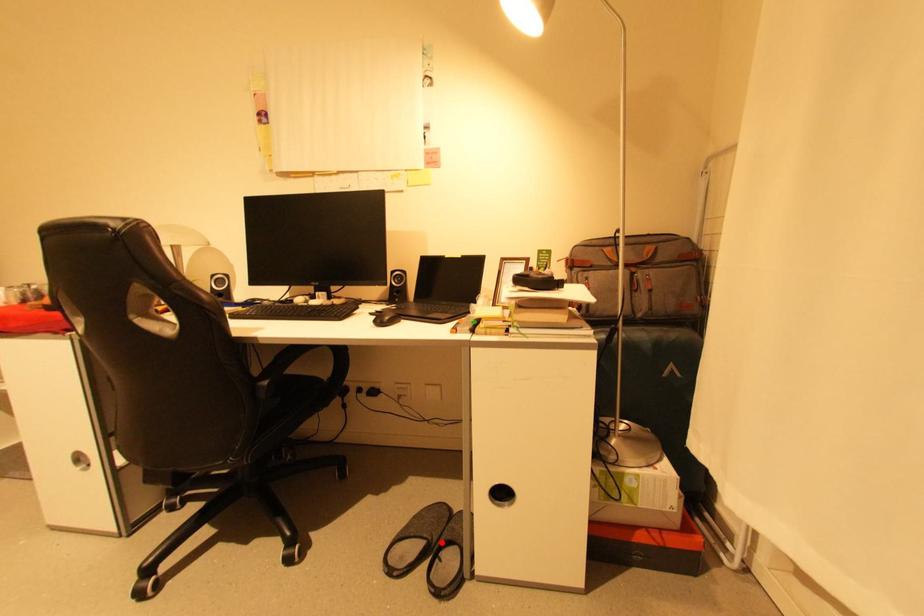
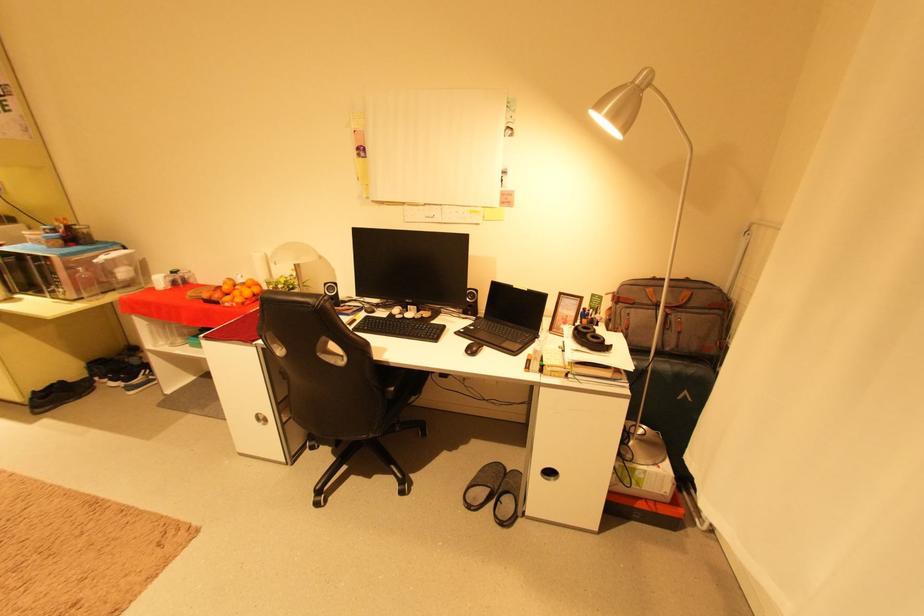
In the second image, find the point that corresponds to the highlighted location in the first image.

(504, 492)